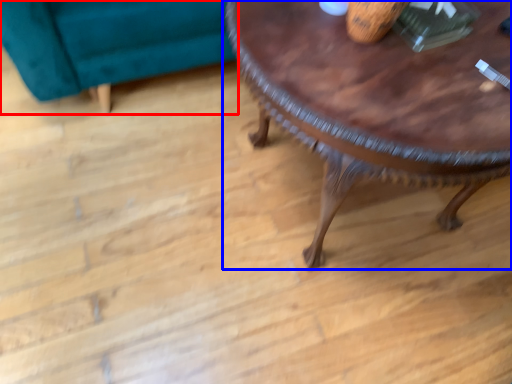
Question: Among these objects, which one is nearest to the camera, swivel chair (highlighted by a red box) or coffee table (highlighted by a blue box)?

Choices:
 (A) swivel chair
 (B) coffee table

Answer: (B)